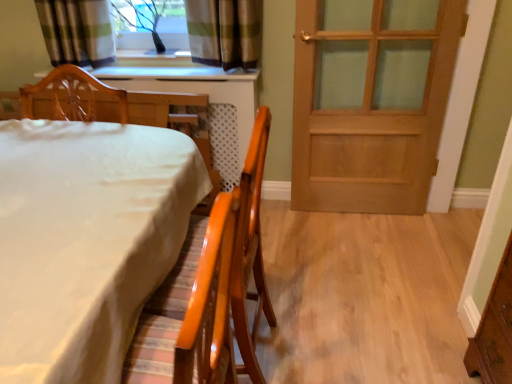
Question: Considering the relative sizes of wooden chair at left, which appears as the first chair when viewed from the left, and white glossy table at lower left in the image provided, is wooden chair at left, which appears as the first chair when viewed from the left, bigger than white glossy table at lower left?

Choices:
 (A) yes
 (B) no

Answer: (B)

Question: Is wooden chair at left, which ranks as the 2th chair in right-to-left order, located outside white glossy table at lower left?

Choices:
 (A) yes
 (B) no

Answer: (A)

Question: Is white glossy table at lower left surrounded by wooden chair at left, which ranks as the 2th chair in right-to-left order?

Choices:
 (A) yes
 (B) no

Answer: (B)

Question: Is wooden chair at left, which appears as the first chair when viewed from the left, facing away from white glossy table at lower left?

Choices:
 (A) no
 (B) yes

Answer: (A)

Question: Is wooden chair at left, which appears as the first chair when viewed from the left, wider than white glossy table at lower left?

Choices:
 (A) no
 (B) yes

Answer: (A)

Question: In the image, is wooden door at right on the left side or the right side of wooden chair at left, which ranks as the 2th chair in right-to-left order?

Choices:
 (A) right
 (B) left

Answer: (A)

Question: From a real-world perspective, is wooden door at right positioned above or below wooden chair at left, which ranks as the 2th chair in right-to-left order?

Choices:
 (A) below
 (B) above

Answer: (A)

Question: Looking at the image, does wooden door at right seem bigger or smaller compared to wooden chair at left, which appears as the first chair when viewed from the left?

Choices:
 (A) small
 (B) big

Answer: (A)

Question: From the image's perspective, relative to wooden chair at left, which ranks as the 2th chair in right-to-left order, is wooden door at right above or below?

Choices:
 (A) above
 (B) below

Answer: (A)

Question: Is clear glass window at upper center wider or thinner than wooden chair at left, which ranks as the 2th chair in right-to-left order?

Choices:
 (A) thin
 (B) wide

Answer: (A)

Question: Relative to wooden chair at left, which ranks as the 2th chair in right-to-left order, is clear glass window at upper center in front or behind?

Choices:
 (A) front
 (B) behind

Answer: (B)

Question: Considering the positions of point (170, 18) and point (131, 99), is point (170, 18) closer or farther from the camera than point (131, 99)?

Choices:
 (A) closer
 (B) farther

Answer: (B)

Question: From a real-world perspective, is clear glass window at upper center physically located above or below wooden chair at left, which ranks as the 2th chair in right-to-left order?

Choices:
 (A) above
 (B) below

Answer: (A)

Question: Looking at their shapes, would you say wooden door at right is wider or thinner than white glossy table at lower left?

Choices:
 (A) thin
 (B) wide

Answer: (A)

Question: Visually, is wooden door at right positioned to the left or to the right of white glossy table at lower left?

Choices:
 (A) left
 (B) right

Answer: (B)